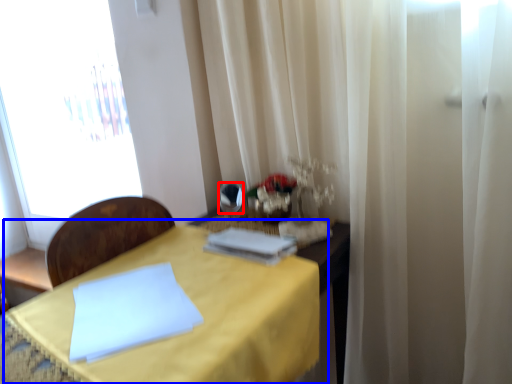
Question: Which object appears farthest to the camera in this image, mirror (highlighted by a red box) or table (highlighted by a blue box)?

Choices:
 (A) mirror
 (B) table

Answer: (A)